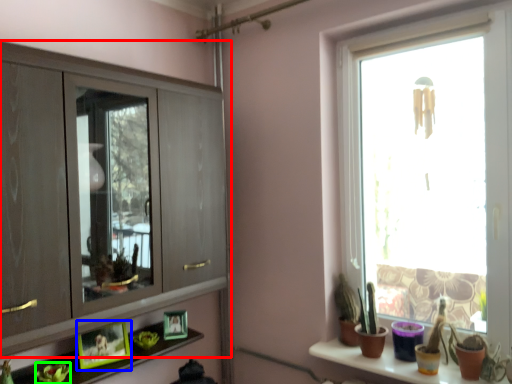
Question: Considering the real-world distances, which object is closest to cupboard (highlighted by a red box)? picture frame (highlighted by a blue box) or plant (highlighted by a green box).

Choices:
 (A) picture frame
 (B) plant

Answer: (A)